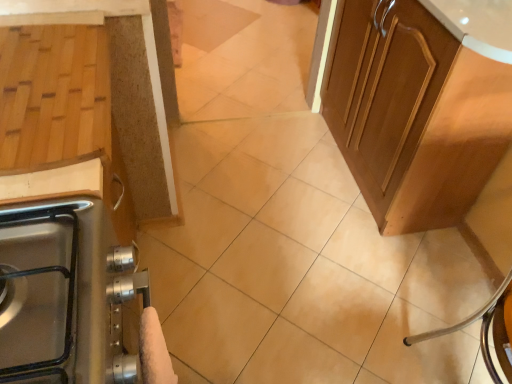
Locate an element on the screen. The image size is (512, 384). free location in front of glossy wood cabinet at upper right, which is counted as the first cabinetry, starting from the right is located at coordinates (358, 284).